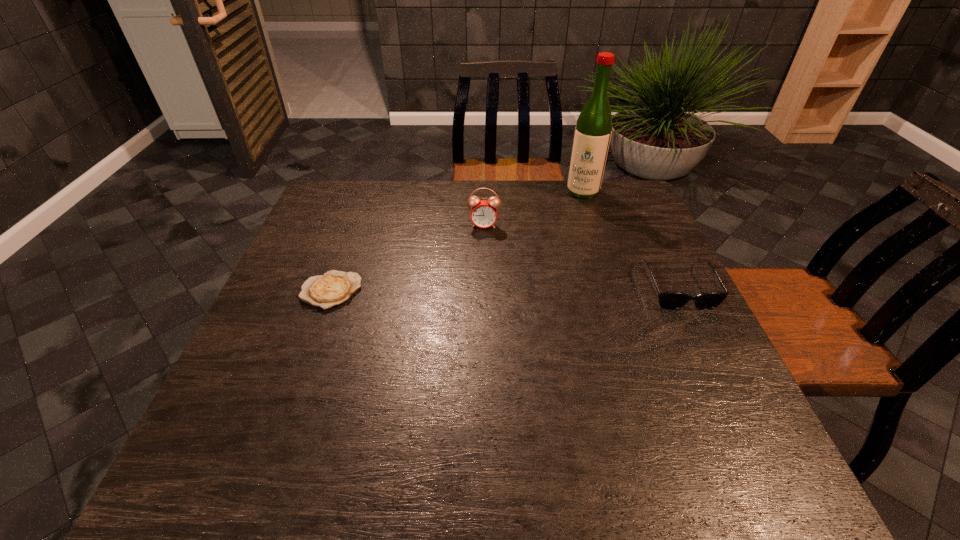
Where is `free space on the desktop that is between the leftmost object and the rightmost object and is positioned on the clock face of the alarm clock`? This screenshot has height=540, width=960. free space on the desktop that is between the leftmost object and the rightmost object and is positioned on the clock face of the alarm clock is located at coordinates (476, 289).

Locate an element on the screen. The image size is (960, 540). vacant spot on the desktop that is between the shortest object and the sunglasses and is positioned on the label of the tallest object is located at coordinates (x=553, y=288).